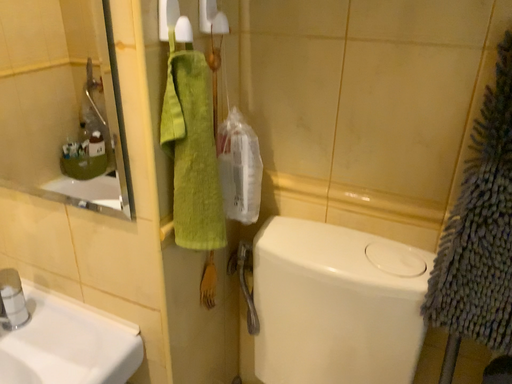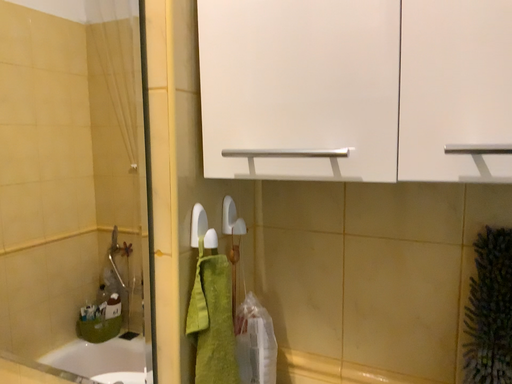
Question: Which way did the camera rotate in the video?

Choices:
 (A) rotated downward
 (B) rotated upward

Answer: (B)